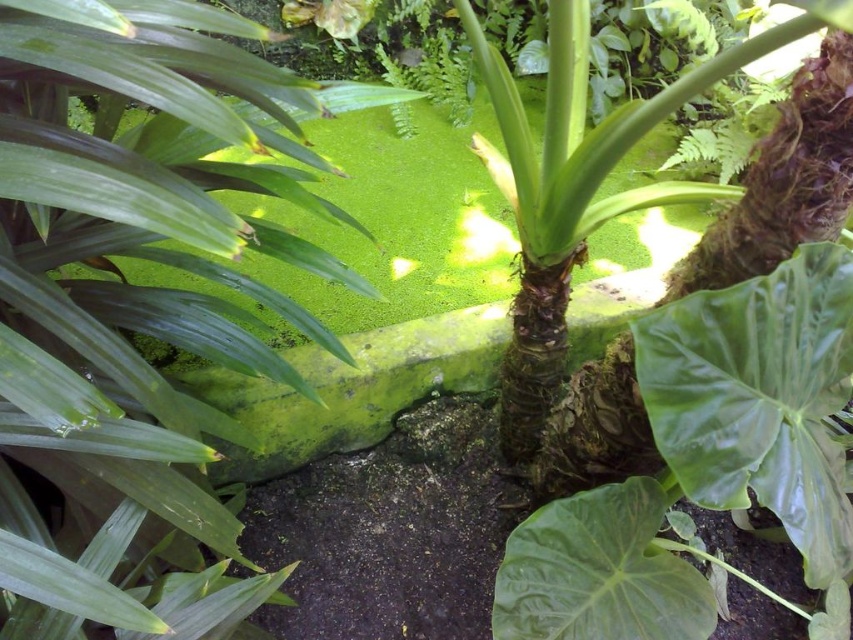
Does point (689, 296) come behind point (506, 557)?

That is False.

Which of these two, green glossy leaf at center or green matte leaf at center, stands taller?

green glossy leaf at center

Who is more distant from viewer, (705,312) or (508,596)?

Positioned behind is point (508,596).

Identify the location of green glossy leaf at center. The width and height of the screenshot is (853, 640). tap(759, 397).